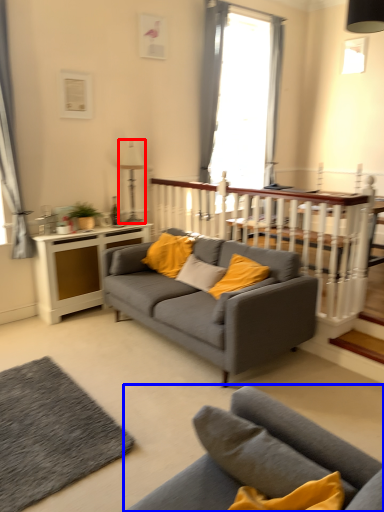
Question: Which of the following is the closest to the observer, lamp (highlighted by a red box) or studio couch (highlighted by a blue box)?

Choices:
 (A) lamp
 (B) studio couch

Answer: (B)